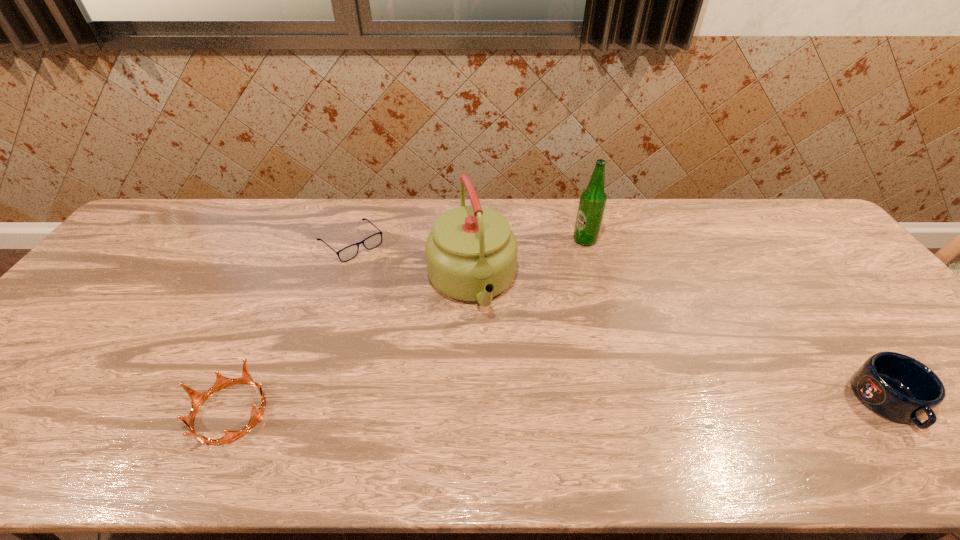
In order to click on free space between the crown and the rightmost object in this screenshot , I will do `click(559, 407)`.

The width and height of the screenshot is (960, 540). Find the location of `vacant space that is in between the spectacles and the kettle`. vacant space that is in between the spectacles and the kettle is located at coordinates (411, 262).

Identify the location of free spot between the kettle and the shortest object. This screenshot has width=960, height=540. point(411,262).

The height and width of the screenshot is (540, 960). Find the location of `empty space between the crown and the kettle`. empty space between the crown and the kettle is located at coordinates (351, 348).

Where is `free spot between the kettle and the second object from right to left`? free spot between the kettle and the second object from right to left is located at coordinates (528, 261).

Locate which object is the closest to the third object from left to right. Please provide its 2D coordinates. Your answer should be formatted as a tuple, i.e. [(x, y)], where the tuple contains the x and y coordinates of a point satisfying the conditions above.

[(373, 241)]

Where is `object that is the second closest to the rightmost object`? Image resolution: width=960 pixels, height=540 pixels. object that is the second closest to the rightmost object is located at coordinates (471, 253).

The image size is (960, 540). In order to click on vacant space that satisfies the following two spatial constraints: 1. on the back side of the third object from left to right; 2. on the right side of the second object from right to left in this screenshot , I will do `click(472, 240)`.

Where is `free location that satisfies the following two spatial constraints: 1. on the back side of the crown; 2. on the left side of the fourth object from left to right`? free location that satisfies the following two spatial constraints: 1. on the back side of the crown; 2. on the left side of the fourth object from left to right is located at coordinates point(306,240).